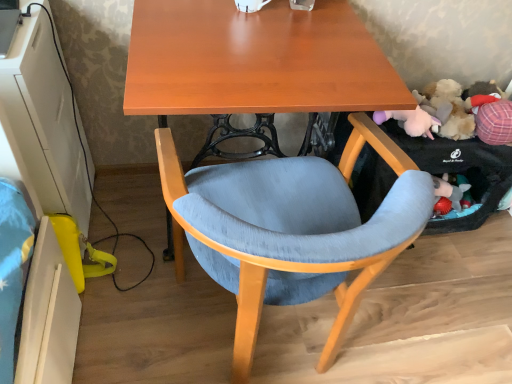
Locate an element on the screen. This screenshot has height=384, width=512. vacant area on top of matte wood desk at center (from a real-world perspective) is located at coordinates (256, 39).